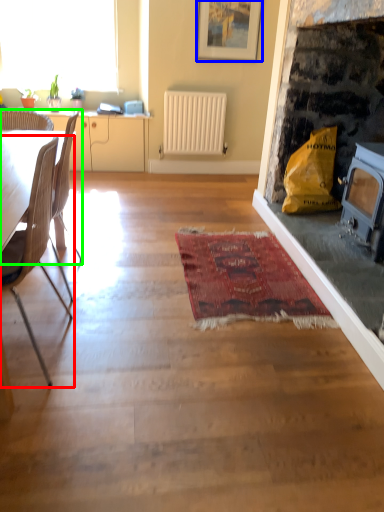
Question: Which object is positioned closest to chair (highlighted by a red box)? Select from picture frame (highlighted by a blue box) and chair (highlighted by a green box).

Choices:
 (A) picture frame
 (B) chair

Answer: (B)